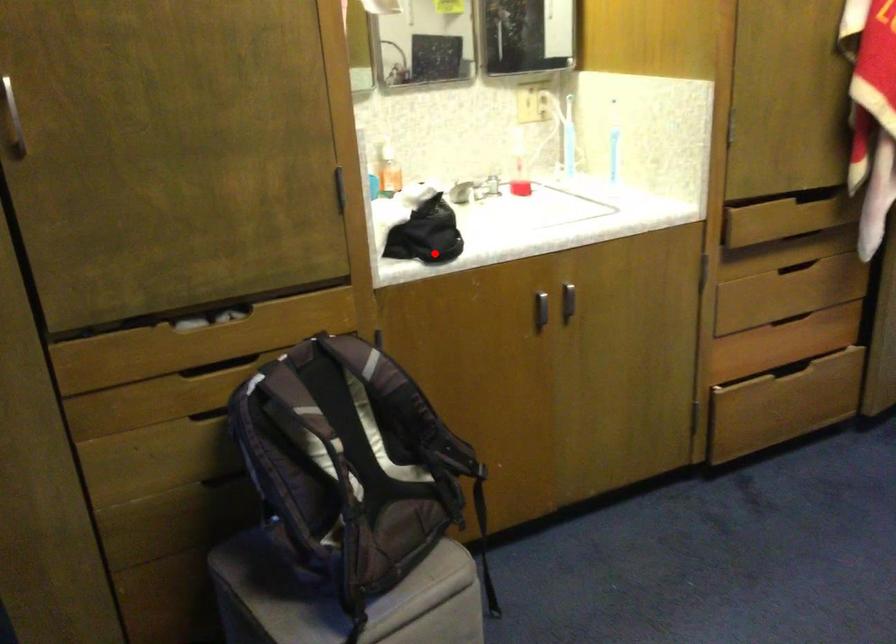
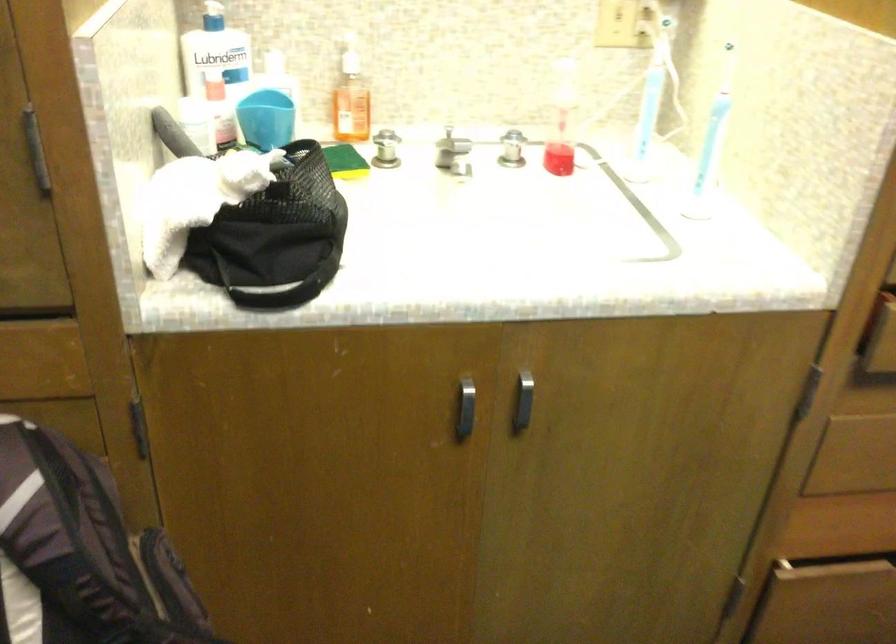
The point at the highlighted location is marked in the first image. Where is the corresponding point in the second image?

(279, 286)